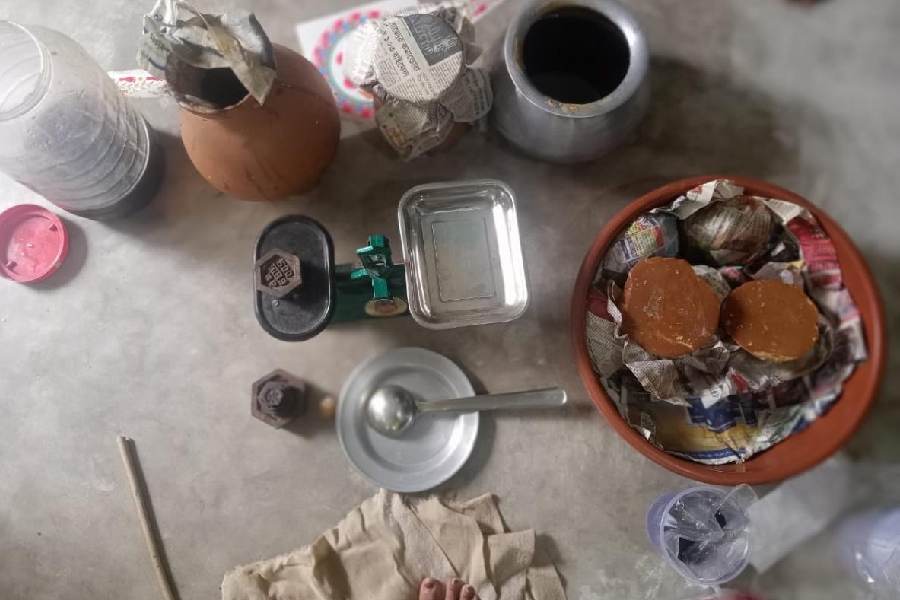
Where is `silver spoon`? The image size is (900, 600). silver spoon is located at coordinates (392, 409).